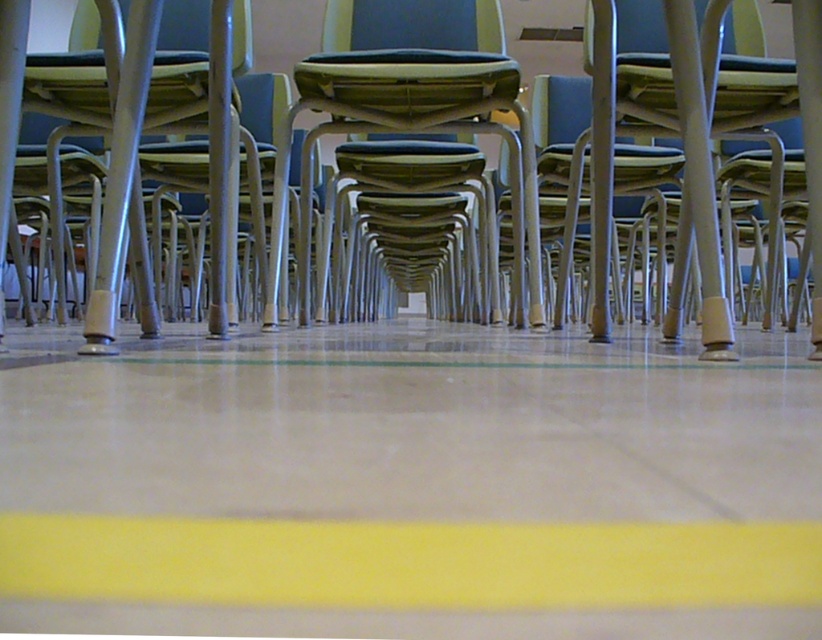
From the picture: Who is higher up, matte black chair at center or metallic gray chair at center?

Positioned higher is matte black chair at center.

Is point (416, 188) positioned before point (12, 134)?

No.

You are a GUI agent. You are given a task and a screenshot of the screen. Output one action in this format:
    pyautogui.click(x=<x>, y=<y>)
    Task: Click on the matte black chair at center
    This screenshot has width=822, height=640.
    Given the screenshot: What is the action you would take?
    pyautogui.click(x=419, y=99)

Locate an element on the screen. Image resolution: width=822 pixels, height=640 pixels. matte black chair at center is located at coordinates (x=419, y=99).

Can you confirm if yellow matte line at lower center is positioned to the right of metallic gray chair at center?

No, yellow matte line at lower center is not to the right of metallic gray chair at center.

Locate an element on the screen. yellow matte line at lower center is located at coordinates (409, 563).

Between yellow matte line at lower center and matte black chair at center, which one is positioned lower?

yellow matte line at lower center is below.

Can you confirm if yellow matte line at lower center is positioned above matte black chair at center?

No, yellow matte line at lower center is not above matte black chair at center.

Between point (820, 577) and point (523, 221), which one is positioned behind?

Point (523, 221)

At what (x,y) coordinates should I click in order to perform the action: click on yellow matte line at lower center. Please return your answer as a coordinate pair (x, y). This screenshot has height=640, width=822. Looking at the image, I should click on (409, 563).